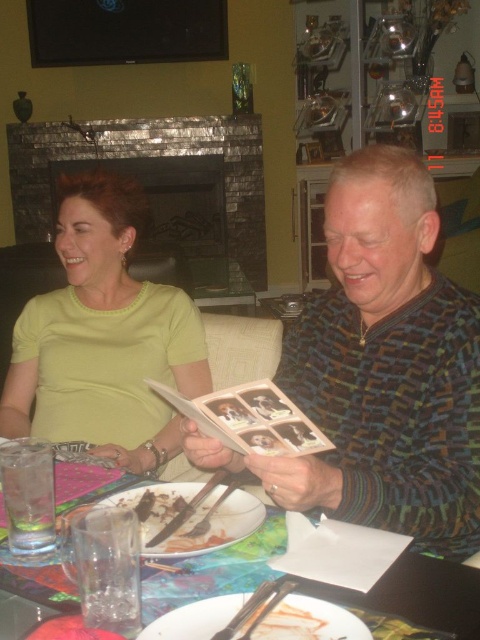
You are a photographer setting up a shoot in this scene. You need to position a spotlight so that it illuminates the multicolored sweater at center and the lime green shirt at center without casting shadows on the background wall. Given that the spotlight can only be placed in front of the subjects, where should you place it relative to the two items?

The multicolored sweater at center is in front of the lime green shirt at center, so the spotlight should be placed in front of the multicolored sweater at center to avoid casting shadows on the background wall.

You are a photographer standing at the point marked as point [466,440]. You want to take a photo of the two people sitting at the table. Do you think you can fit both of them in the frame without moving the camera? Please explain your reasoning.

The two people are 35.10 inches apart. Since the photographer is at point [466,440], which is likely positioned to capture the entire table and the subjects, it is possible to fit both individuals in the frame as they are within a reasonable distance from each other and the camera position allows for an encompassing shot.